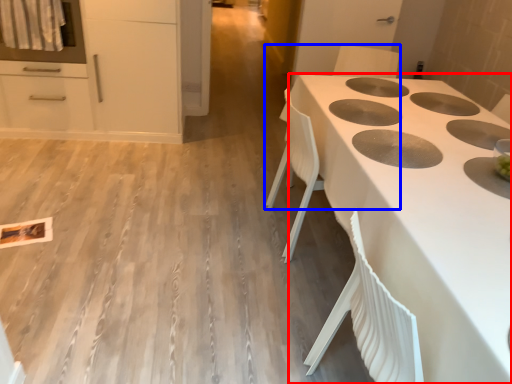
Question: Which of the following is the farthest to the observer, countertop (highlighted by a red box) or chair (highlighted by a blue box)?

Choices:
 (A) countertop
 (B) chair

Answer: (B)